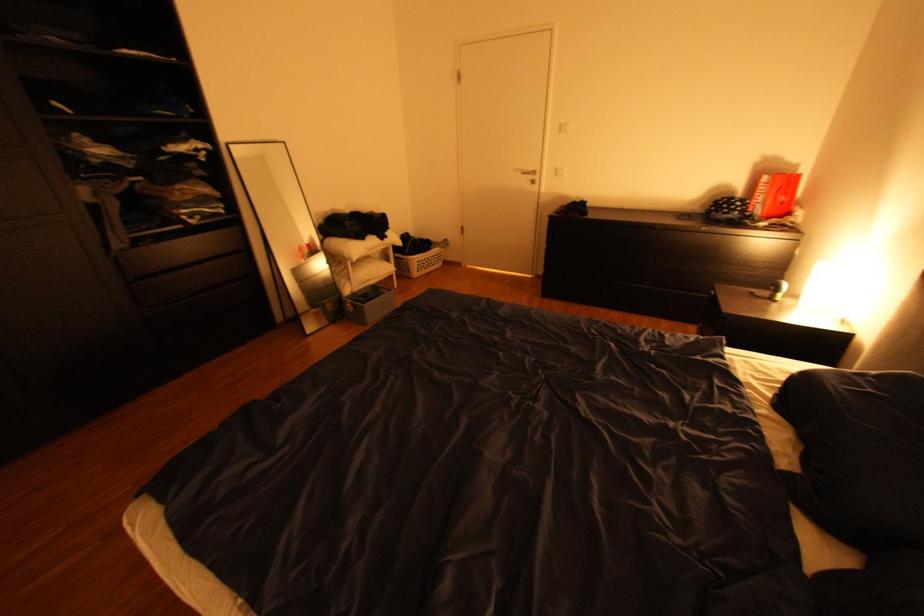
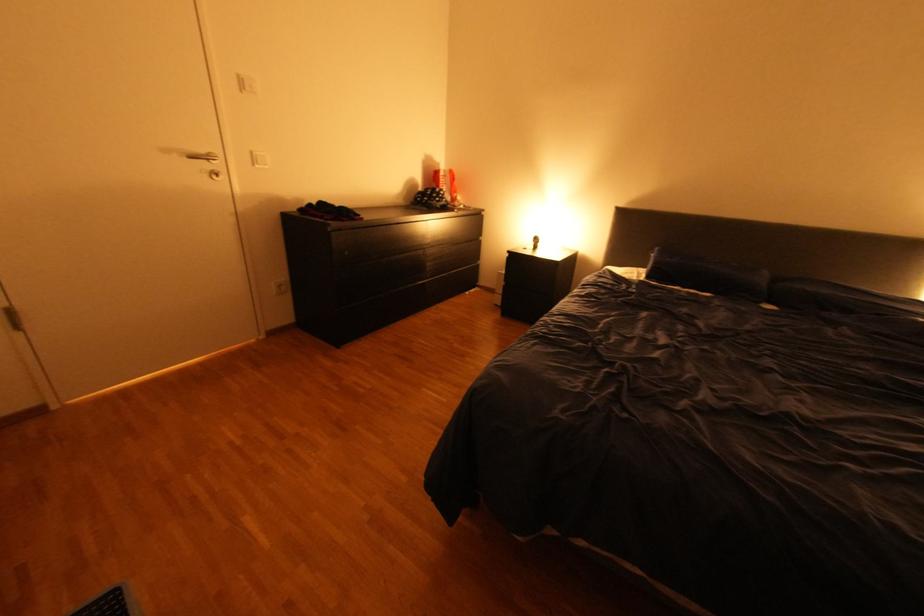
Where in the second image is the point corresponding to point 565,174 from the first image?

(264, 161)